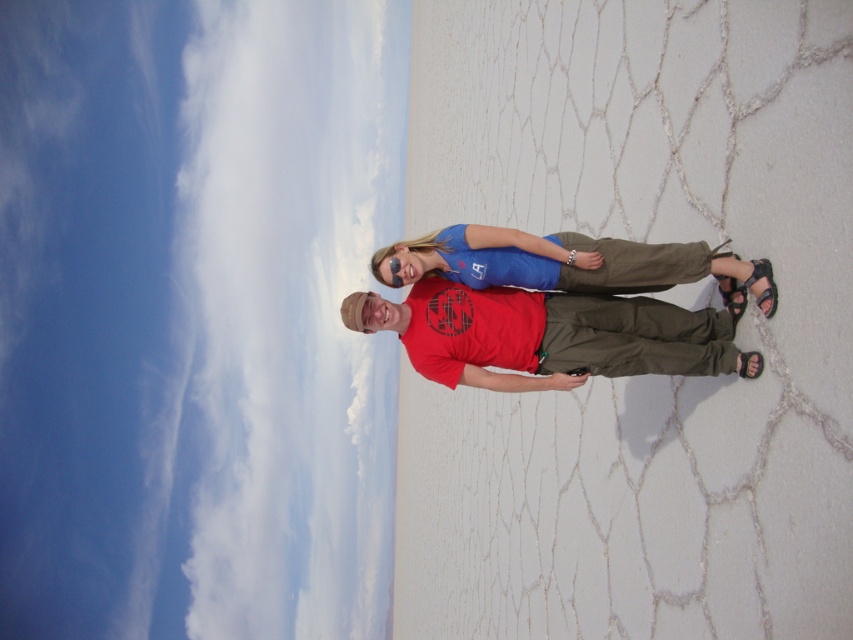
Question: Which object is the closest to the black synthetic sandal at lower right?

Choices:
 (A) black leather sandal at lower right
 (B) white fluffy cloud at upper left

Answer: (A)

Question: Does matte red t-shirt at center have a smaller size compared to black leather sandal at lower right?

Choices:
 (A) yes
 (B) no

Answer: (B)

Question: Which object is closer to the camera taking this photo?

Choices:
 (A) matte red t-shirt at center
 (B) black synthetic sandal at lower right
 (C) white fluffy cloud at upper left
 (D) black leather sandal at lower right

Answer: (D)

Question: Does black leather sandal at lower right appear under black synthetic sandal at lower right?

Choices:
 (A) no
 (B) yes

Answer: (A)

Question: Which of these objects is positioned farthest from the black leather sandal at lower right?

Choices:
 (A) matte red t-shirt at center
 (B) black synthetic sandal at lower right

Answer: (A)

Question: Is black leather sandal at lower right further to camera compared to black synthetic sandal at lower right?

Choices:
 (A) yes
 (B) no

Answer: (B)